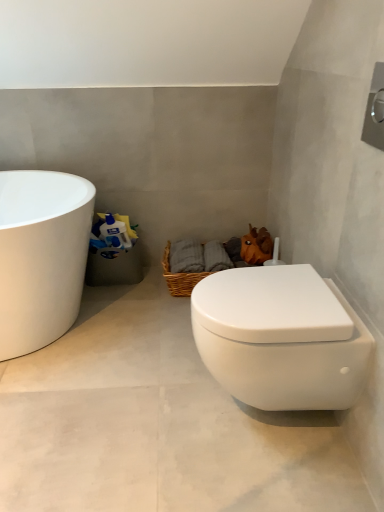
At what (x,y) coordinates should I click in order to perform the action: click on free area below white glossy toilet at lower right (from a real-world perspective). Please return your answer as a coordinate pair (x, y). This screenshot has width=384, height=512. Looking at the image, I should click on (259, 419).